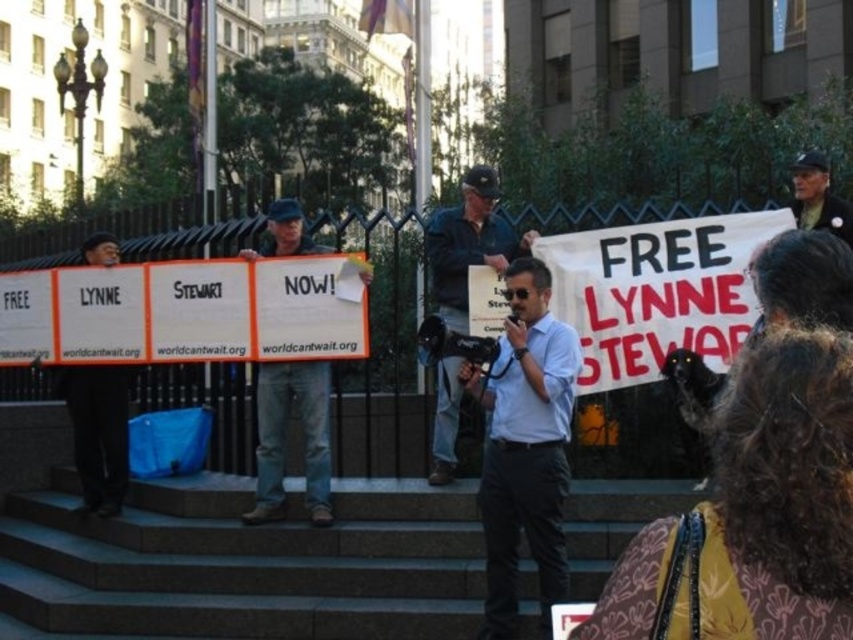
You are a photographer trying to capture the entire scene of the protest. You notice the gray stone stairs at center and the dark blue uniform at upper right. Which object is closer to the camera?

The gray stone stairs at center is closer to the camera because it is in front of the dark blue uniform at upper right.